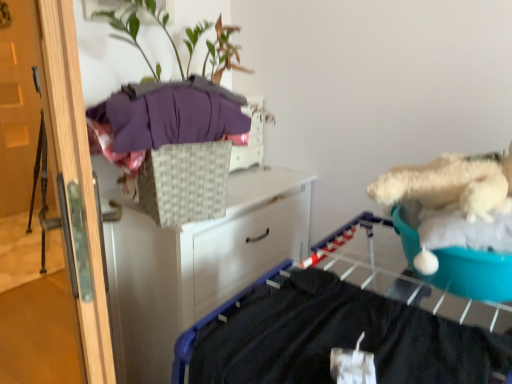
Question: Is purple soft fabric at upper left thinner than wooden door at left?

Choices:
 (A) no
 (B) yes

Answer: (A)

Question: Is purple soft fabric at upper left smaller than wooden door at left?

Choices:
 (A) no
 (B) yes

Answer: (B)

Question: Is purple soft fabric at upper left positioned before wooden door at left?

Choices:
 (A) yes
 (B) no

Answer: (B)

Question: Is the depth of purple soft fabric at upper left greater than that of wooden door at left?

Choices:
 (A) no
 (B) yes

Answer: (B)

Question: Can you confirm if purple soft fabric at upper left is positioned to the left of wooden door at left?

Choices:
 (A) no
 (B) yes

Answer: (A)

Question: From the image's perspective, is purple soft fabric at upper left located above wooden door at left?

Choices:
 (A) yes
 (B) no

Answer: (A)

Question: From a real-world perspective, does white woven basket at upper center stand above green leafy plant at upper center?

Choices:
 (A) yes
 (B) no

Answer: (B)

Question: Is white woven basket at upper center placed right next to green leafy plant at upper center?

Choices:
 (A) no
 (B) yes

Answer: (A)

Question: Is the position of white woven basket at upper center less distant than that of green leafy plant at upper center?

Choices:
 (A) yes
 (B) no

Answer: (B)

Question: Can you confirm if white woven basket at upper center is shorter than green leafy plant at upper center?

Choices:
 (A) no
 (B) yes

Answer: (B)

Question: Is white woven basket at upper center wider than green leafy plant at upper center?

Choices:
 (A) yes
 (B) no

Answer: (B)

Question: Can you confirm if white woven basket at upper center is taller than green leafy plant at upper center?

Choices:
 (A) no
 (B) yes

Answer: (A)

Question: From the image's perspective, is wooden door at left over green leafy plant at upper center?

Choices:
 (A) no
 (B) yes

Answer: (A)